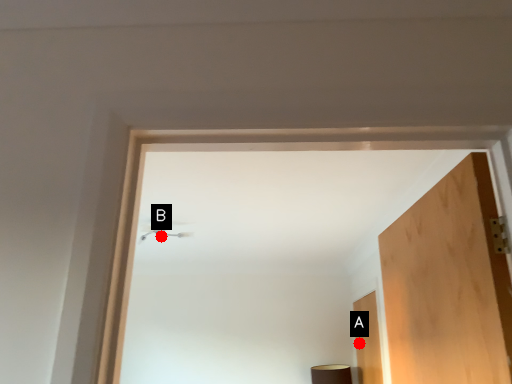
Question: Two points are circled on the image, labeled by A and B beside each circle. Which point is closer to the camera?

Choices:
 (A) A is closer
 (B) B is closer

Answer: (B)